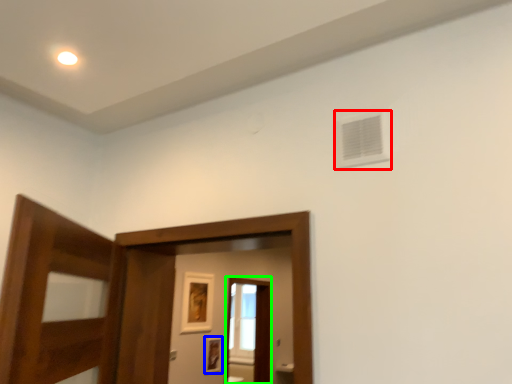
Question: Based on their relative distances, which object is farther from air conditioning (highlighted by a red box)? Choose from picture frame (highlighted by a blue box) and screen door (highlighted by a green box).

Choices:
 (A) picture frame
 (B) screen door

Answer: (B)